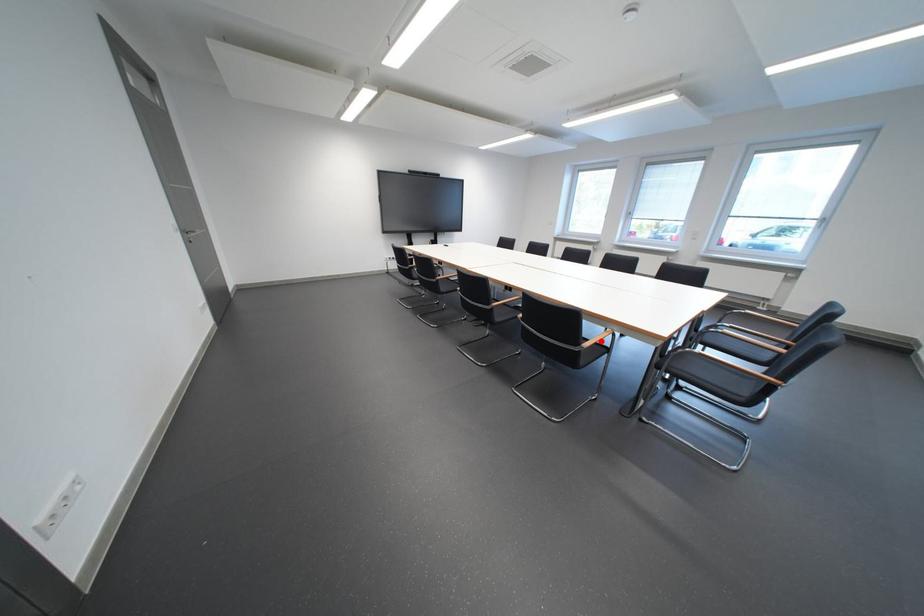
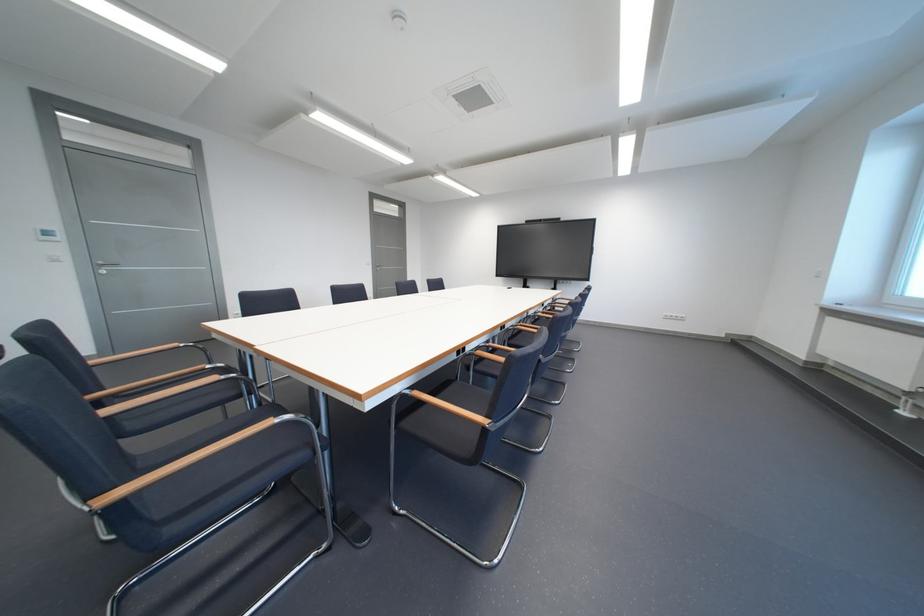
Question: I am providing you with two images of the same scene from different viewpoints. A red point is marked on the first image. At the location where the point appears in image 1, is it still visible in image 2?

Choices:
 (A) Yes
 (B) No

Answer: (B)